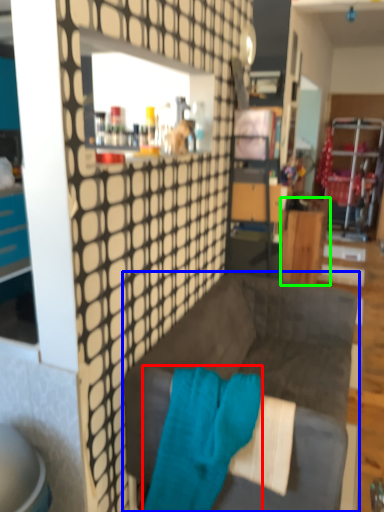
Question: Estimate the real-world distances between objects in this image. Which object is farther from bath towel (highlighted by a red box), studio couch (highlighted by a blue box) or desk (highlighted by a green box)?

Choices:
 (A) studio couch
 (B) desk

Answer: (B)